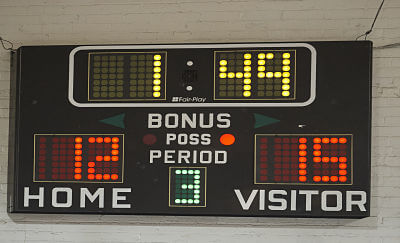
I want to click on wall, so click(285, 25).